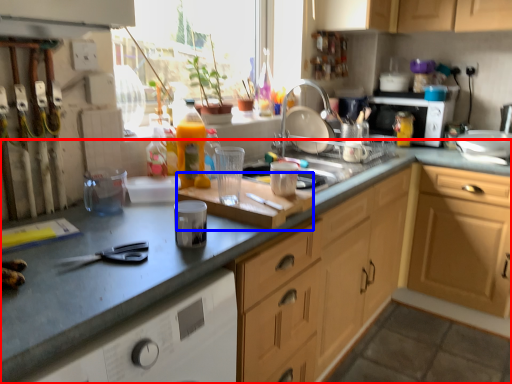
Question: Which point is further to the camera, countertop (highlighted by a red box) or cutting board (highlighted by a blue box)?

Choices:
 (A) countertop
 (B) cutting board

Answer: (B)